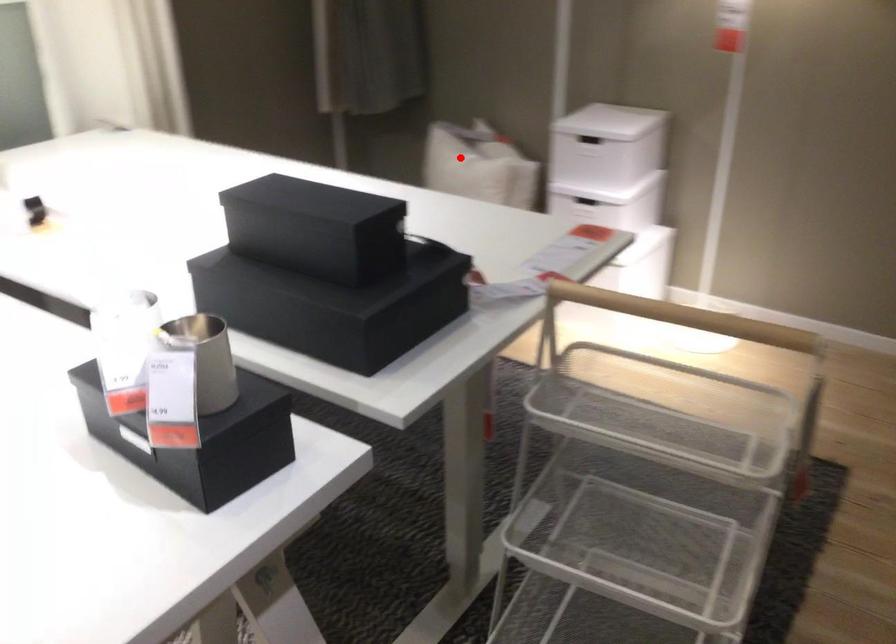
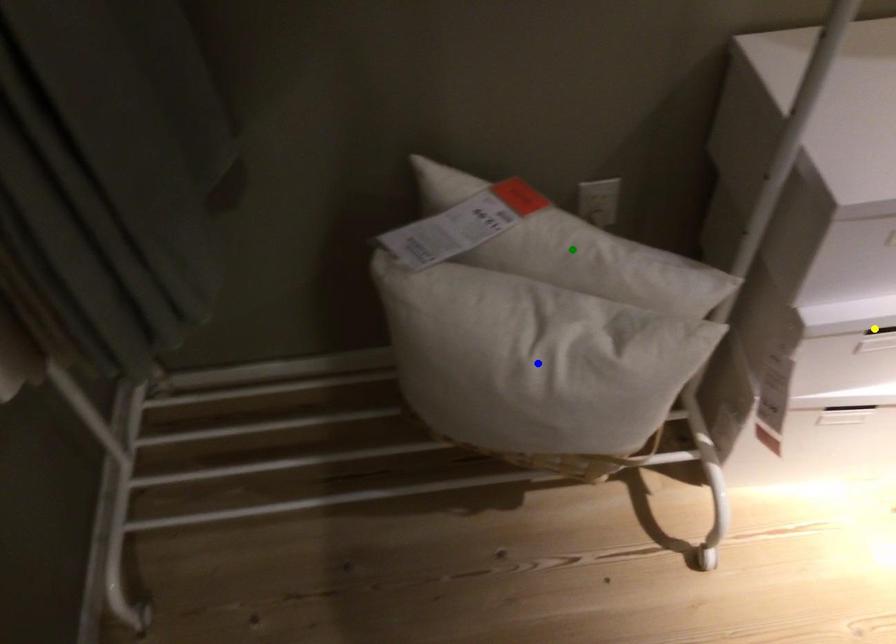
Question: I am providing you with two images of the same scene from different viewpoints. A red point is marked on the first image. You are given multiple points on the second image. Which spot in image 2 lines up with the point in image 1?

Choices:
 (A) yellow point
 (B) green point
 (C) blue point

Answer: (C)